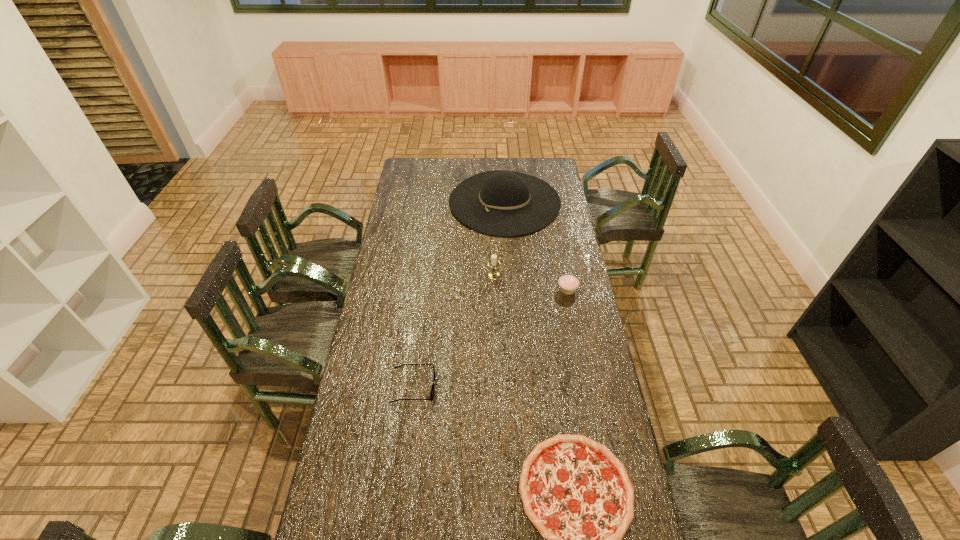
The height and width of the screenshot is (540, 960). Find the location of `sombrero`. sombrero is located at coordinates (500, 203).

The width and height of the screenshot is (960, 540). I want to click on the farthest object, so click(x=500, y=203).

This screenshot has height=540, width=960. I want to click on the second farthest object, so click(493, 274).

Find the location of a particular element. The image size is (960, 540). the fourth shortest object is located at coordinates (493, 274).

Find the location of a particular element. This screenshot has width=960, height=540. the third nearest object is located at coordinates (568, 284).

Where is `the second nearest object`? The height and width of the screenshot is (540, 960). the second nearest object is located at coordinates (432, 391).

At what (x,y) coordinates should I click in order to perform the action: click on blank area located 0.260m on the front-facing side of the sombrero. Please return your answer as a coordinate pair (x, y). Looking at the image, I should click on (400, 202).

At what (x,y) coordinates should I click in order to perform the action: click on vacant space situated 0.170m on the front-facing side of the sombrero. Please return your answer as a coordinate pair (x, y). The width and height of the screenshot is (960, 540). Looking at the image, I should click on (418, 202).

Image resolution: width=960 pixels, height=540 pixels. In order to click on free space located on the front-facing side of the sombrero in this screenshot , I will do `click(418, 202)`.

The width and height of the screenshot is (960, 540). Identify the location of vacant region located on the right of the candle holder. (563, 275).